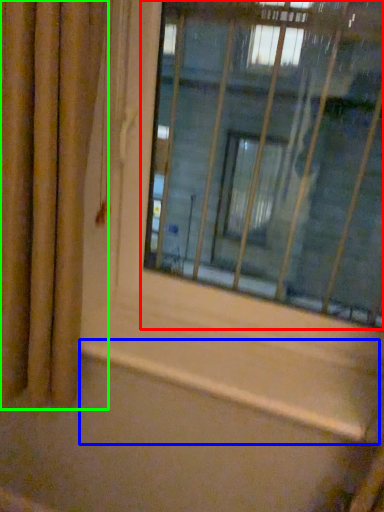
Question: Based on their relative distances, which object is nearer to window (highlighted by a red box)? Choose from window sill (highlighted by a blue box) and curtain (highlighted by a green box).

Choices:
 (A) window sill
 (B) curtain

Answer: (B)